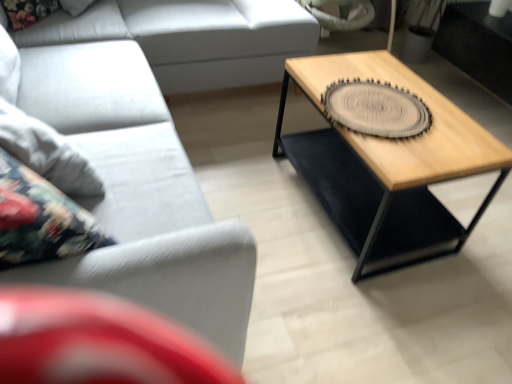
I want to click on free space in front of wooden/black metal coffee table at right, so click(x=369, y=310).